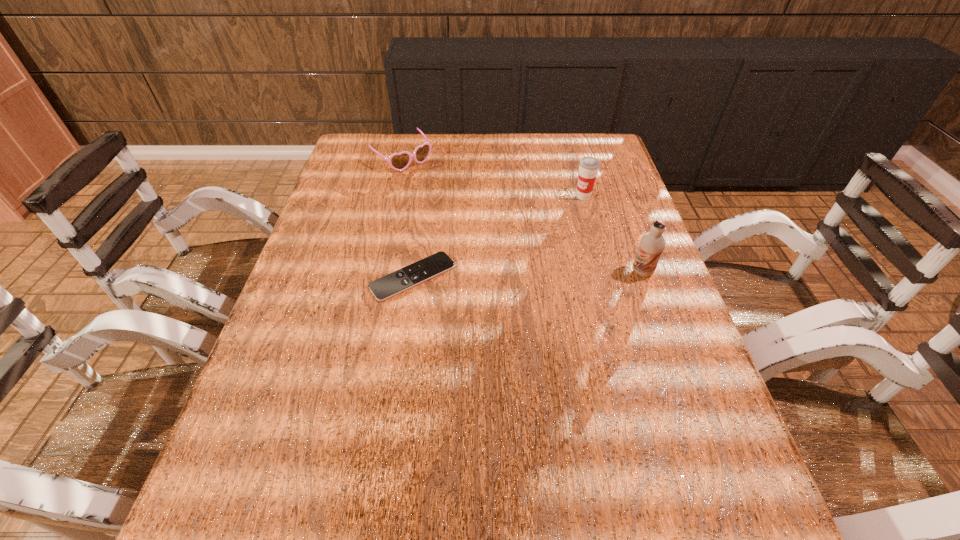
The height and width of the screenshot is (540, 960). I want to click on empty location between the second shortest object and the shortest object, so click(407, 218).

Where is `free point between the third tallest object and the rightmost object`? free point between the third tallest object and the rightmost object is located at coordinates (x=522, y=215).

The height and width of the screenshot is (540, 960). In order to click on empty location between the chocolate milk and the remote control in this screenshot , I will do `click(528, 274)`.

Identify the location of vacant area between the rightmost object and the sunglasses. The width and height of the screenshot is (960, 540). (522, 215).

I want to click on the third closest object to the second shortest object, so click(x=652, y=244).

This screenshot has width=960, height=540. Find the location of `object that is the closest to the chocolate milk`. object that is the closest to the chocolate milk is located at coordinates (588, 166).

The image size is (960, 540). Find the location of `free space in the image that satisfies the following two spatial constraints: 1. on the back side of the shortest object; 2. on the left side of the rightmost object`. free space in the image that satisfies the following two spatial constraints: 1. on the back side of the shortest object; 2. on the left side of the rightmost object is located at coordinates (414, 272).

Find the location of `vacant space that satisfies the following two spatial constraints: 1. on the back side of the shortest object; 2. on the right side of the chocolate milk`. vacant space that satisfies the following two spatial constraints: 1. on the back side of the shortest object; 2. on the right side of the chocolate milk is located at coordinates (414, 272).

The height and width of the screenshot is (540, 960). Identify the location of vacant space that satisfies the following two spatial constraints: 1. on the front side of the sunglasses; 2. on the right side of the second object from right to left. (394, 197).

This screenshot has height=540, width=960. I want to click on free spot that satisfies the following two spatial constraints: 1. on the front side of the chocolate milk; 2. on the right side of the sunglasses, so click(x=376, y=272).